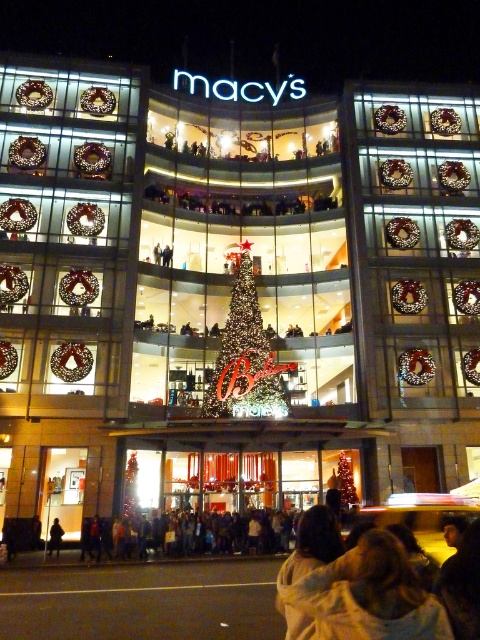
Does illuminated glass christmas tree at center appear over dark brown leather jacket at lower left?

Indeed, illuminated glass christmas tree at center is positioned over dark brown leather jacket at lower left.

The height and width of the screenshot is (640, 480). What do you see at coordinates (245, 356) in the screenshot?
I see `illuminated glass christmas tree at center` at bounding box center [245, 356].

Locate an element on the screen. The image size is (480, 640). illuminated glass christmas tree at center is located at coordinates (245, 356).